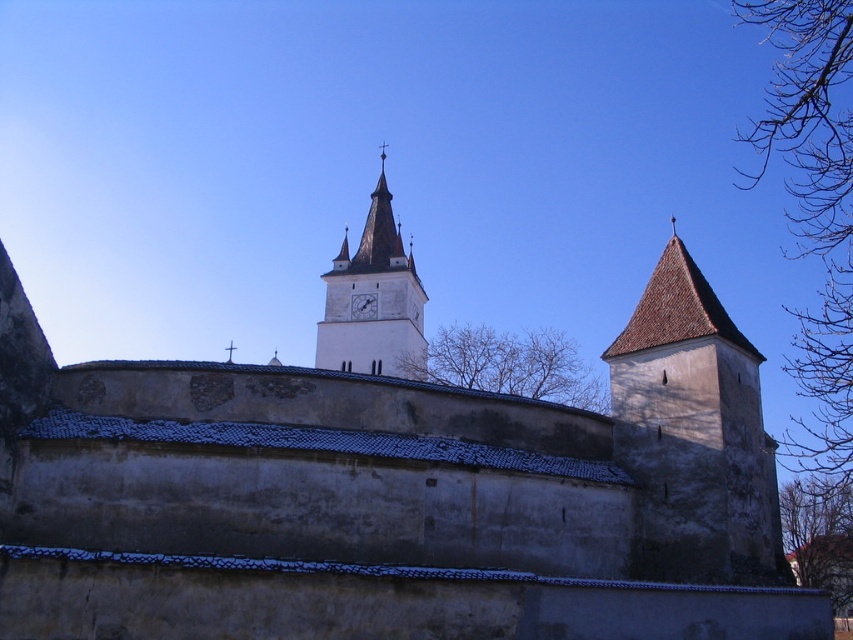
Question: Is the position of white stone clock tower at center less distant than that of white glossy clock at center?

Choices:
 (A) no
 (B) yes

Answer: (B)

Question: Considering the real-world distances, which object is farthest from the brown stone tower at right?

Choices:
 (A) white glossy clock at center
 (B) white stone clock tower at center

Answer: (A)

Question: Which of the following is the closest to the observer?

Choices:
 (A) (341, 252)
 (B) (724, 369)

Answer: (B)

Question: Is white stone clock tower at center to the right of white glossy clock at center from the viewer's perspective?

Choices:
 (A) yes
 (B) no

Answer: (A)

Question: Among these points, which one is farthest from the camera?

Choices:
 (A) (399, 250)
 (B) (369, 292)

Answer: (A)

Question: Observing the image, what is the correct spatial positioning of brown stone tower at right in reference to white stone clock tower at center?

Choices:
 (A) above
 (B) below

Answer: (B)